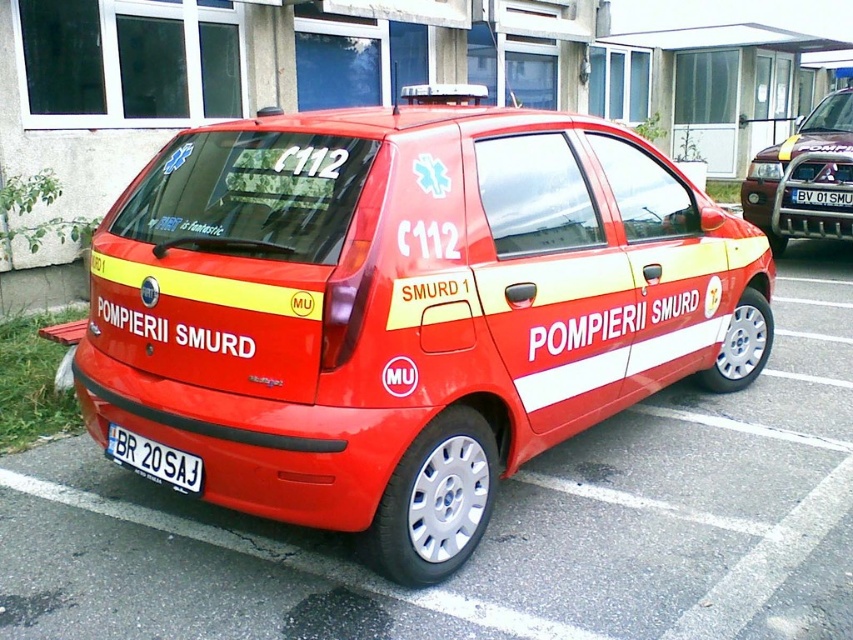
Question: Does matte red car at center have a smaller size compared to white plastic license plate at lower center?

Choices:
 (A) yes
 (B) no

Answer: (B)

Question: Estimate the real-world distances between objects in this image. Which object is farther from the metallic silver suv at upper right?

Choices:
 (A) white plastic license plate at center
 (B) white plastic license plate at lower center

Answer: (B)

Question: Is white plastic license plate at lower center to the left of white plastic license plate at center from the viewer's perspective?

Choices:
 (A) yes
 (B) no

Answer: (A)

Question: Which point is farther to the camera?

Choices:
 (A) (795, 193)
 (B) (819, 204)
 (C) (164, 477)

Answer: (A)

Question: Among these points, which one is farthest from the camera?

Choices:
 (A) (416, 540)
 (B) (817, 120)
 (C) (816, 198)
 (D) (136, 451)

Answer: (B)

Question: Is matte red car at center above white plastic license plate at lower center?

Choices:
 (A) no
 (B) yes

Answer: (B)